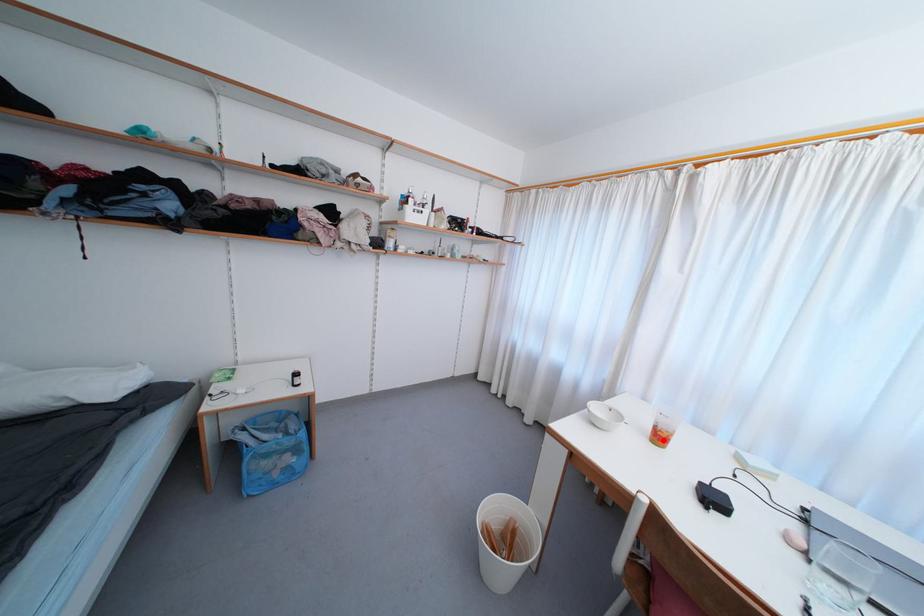
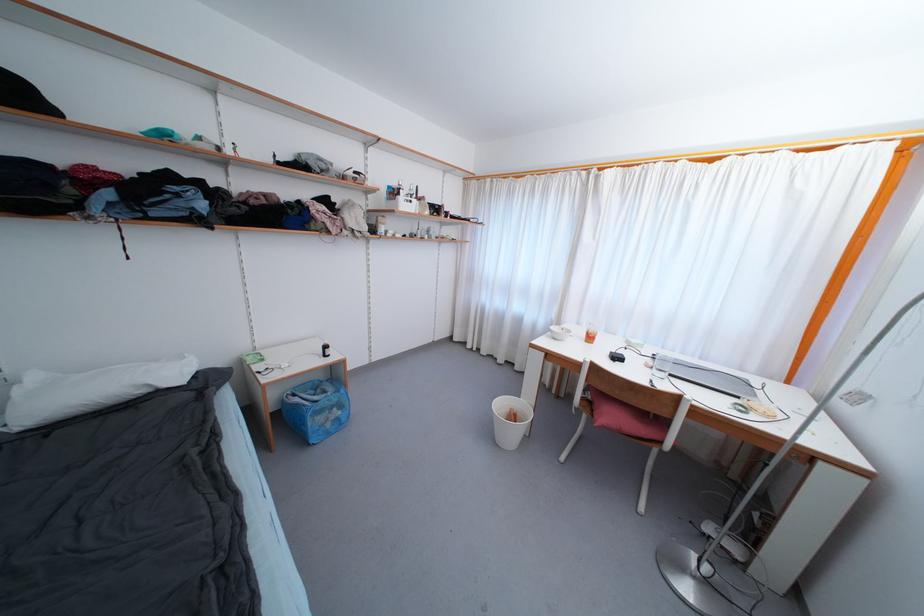
Where in the second image is the point corresponding to the highlighted location from the first image?

(593, 341)